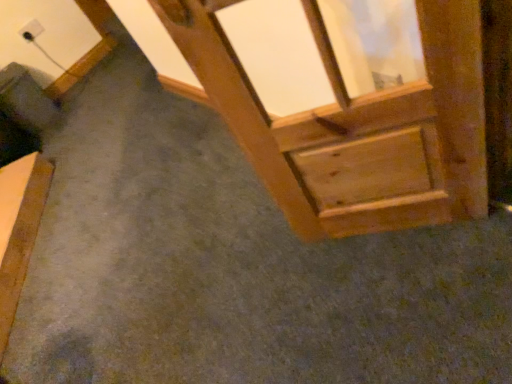
Describe the element at coordinates (31, 30) in the screenshot. I see `white plastic outlet at upper left` at that location.

Describe the element at coordinates (19, 229) in the screenshot. I see `wooden bed frame at lower left` at that location.

Identify the location of wooden frame at upper right. (358, 129).

Find the location of a particular element. The width and height of the screenshot is (512, 384). white plastic outlet at upper left is located at coordinates (31, 30).

Who is more distant, wooden frame at upper right or wooden bed frame at lower left?

wooden bed frame at lower left is further away from the camera.

Does wooden frame at upper right appear on the right side of wooden bed frame at lower left?

Correct, you'll find wooden frame at upper right to the right of wooden bed frame at lower left.

Who is shorter, wooden frame at upper right or wooden bed frame at lower left?

wooden bed frame at lower left.

From a real-world perspective, between wooden bed frame at lower left and wooden frame at upper right, who is vertically higher?

In real-world perspective, wooden frame at upper right is above.

In terms of height, does wooden bed frame at lower left look taller or shorter compared to wooden frame at upper right?

Clearly, wooden bed frame at lower left is shorter compared to wooden frame at upper right.

From the picture: Can you see wooden bed frame at lower left touching wooden frame at upper right?

No, wooden bed frame at lower left is not touching wooden frame at upper right.

How distant is wooden bed frame at lower left from white plastic outlet at upper left?

The distance of wooden bed frame at lower left from white plastic outlet at upper left is 4.46 feet.

From the image's perspective, which object appears higher, wooden bed frame at lower left or white plastic outlet at upper left?

white plastic outlet at upper left appears higher in the image.

Is there a large distance between wooden bed frame at lower left and white plastic outlet at upper left?

Indeed, wooden bed frame at lower left is not near white plastic outlet at upper left.

From a real-world perspective, is white plastic outlet at upper left located beneath wooden bed frame at lower left?

No.

Image resolution: width=512 pixels, height=384 pixels. Identify the location of electric outlet located above the wooden bed frame at lower left (from a real-world perspective). (31, 30).

Which is nearer, (35, 26) or (12, 194)?

The point (12, 194) is closer to the camera.

Looking at the image, does white plastic outlet at upper left seem bigger or smaller compared to wooden bed frame at lower left?

In the image, white plastic outlet at upper left appears to be smaller than wooden bed frame at lower left.

In terms of width, does wooden frame at upper right look wider or thinner when compared to white plastic outlet at upper left?

In the image, wooden frame at upper right appears to be wider than white plastic outlet at upper left.

Considering the sizes of wooden frame at upper right and white plastic outlet at upper left in the image, is wooden frame at upper right taller or shorter than white plastic outlet at upper left?

Clearly, wooden frame at upper right is taller compared to white plastic outlet at upper left.

Which object is closer to the camera, wooden frame at upper right or white plastic outlet at upper left?

wooden frame at upper right is closer to the camera.

Consider the image. Can you confirm if wooden frame at upper right is smaller than white plastic outlet at upper left?

No.

From a real-world perspective, between white plastic outlet at upper left and wooden frame at upper right, who is vertically lower?

From a 3D spatial view, white plastic outlet at upper left is below.

From the image's perspective, which one is positioned higher, white plastic outlet at upper left or wooden frame at upper right?

white plastic outlet at upper left, from the image's perspective.

Does white plastic outlet at upper left have a greater width compared to wooden frame at upper right?

No.

Is point (24, 26) positioned before point (397, 90)?

No, it is not.

In the image, there is a wooden bed frame at lower left. What are the coordinates of `window frame above it (from the image's perspective)` in the screenshot? It's located at (358, 129).

I want to click on furniture lying below the wooden frame at upper right (from the image's perspective), so click(19, 229).

Looking at the image, which one is located closer to wooden frame at upper right, wooden bed frame at lower left or white plastic outlet at upper left?

wooden bed frame at lower left lies closer to wooden frame at upper right than the other object.

Which object lies further to the anchor point white plastic outlet at upper left, wooden bed frame at lower left or wooden frame at upper right?

wooden frame at upper right.

Which object lies nearer to the anchor point wooden frame at upper right, white plastic outlet at upper left or wooden bed frame at lower left?

wooden bed frame at lower left is positioned closer to the anchor wooden frame at upper right.

Looking at the image, which one is located further to wooden bed frame at lower left, white plastic outlet at upper left or wooden frame at upper right?

wooden frame at upper right is positioned further to the anchor wooden bed frame at lower left.

When comparing their distances from wooden bed frame at lower left, does wooden frame at upper right or white plastic outlet at upper left seem closer?

Based on the image, white plastic outlet at upper left appears to be nearer to wooden bed frame at lower left.

Which object lies further to the anchor point white plastic outlet at upper left, wooden frame at upper right or wooden bed frame at lower left?

wooden frame at upper right is further to white plastic outlet at upper left.

This screenshot has width=512, height=384. What are the coordinates of `furniture between wooden frame at upper right and white plastic outlet at upper left along the z-axis` in the screenshot? It's located at (19, 229).